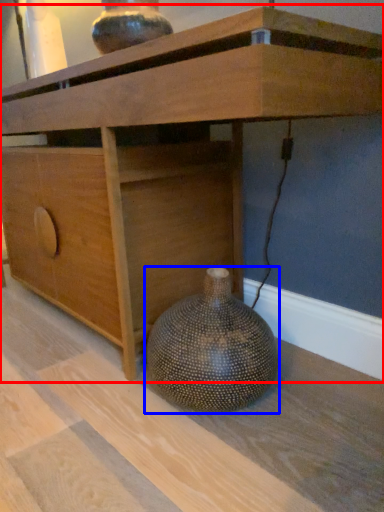
Question: Which point is further to the camera, table (highlighted by a red box) or vase (highlighted by a blue box)?

Choices:
 (A) table
 (B) vase

Answer: (B)